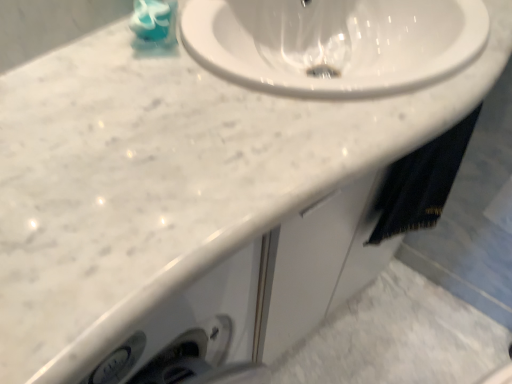
Where is `vacant space in front of teal glossy soap at upper left`? vacant space in front of teal glossy soap at upper left is located at coordinates (134, 102).